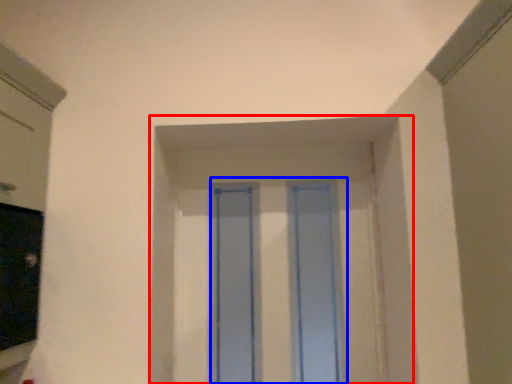
Question: Among these objects, which one is farthest to the camera, window frame (highlighted by a red box) or glass door (highlighted by a blue box)?

Choices:
 (A) window frame
 (B) glass door

Answer: (A)